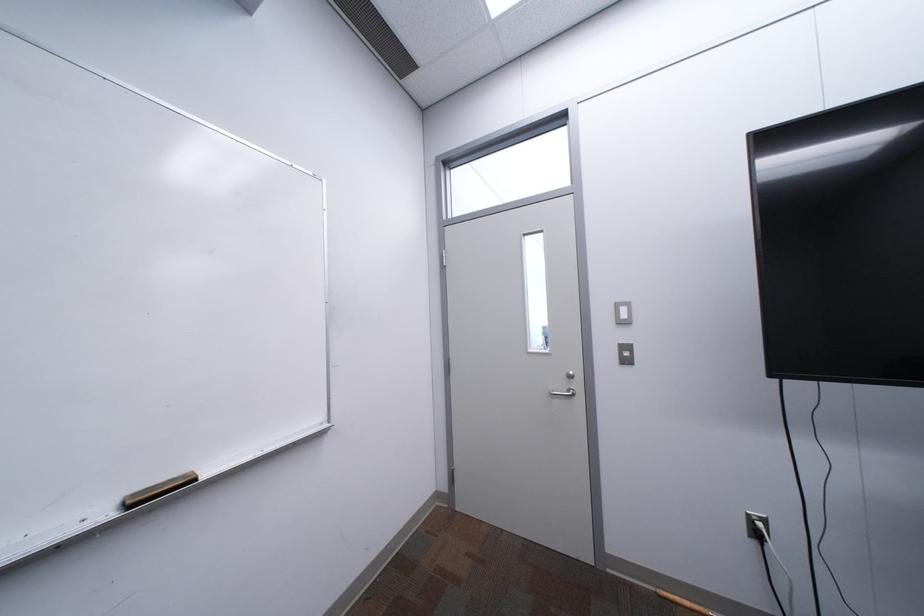
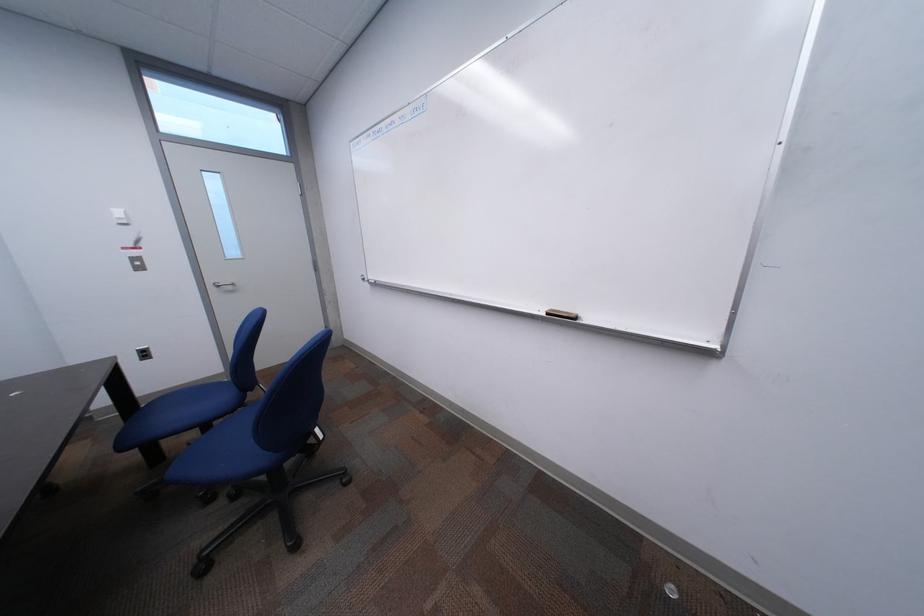
Based on the continuous images, in which direction is the camera rotating?

The camera's rotation is toward left-down.